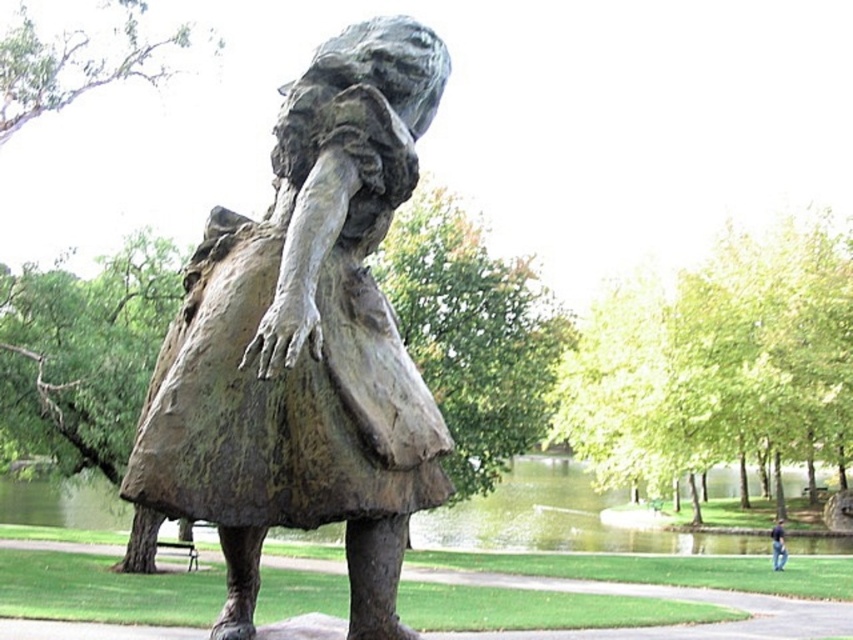
Question: Can you confirm if bronze statue at center is positioned to the left of dark blue jeans at lower right?

Choices:
 (A) no
 (B) yes

Answer: (B)

Question: In this image, where is bronze statue at center located relative to dark blue jeans at lower right?

Choices:
 (A) right
 (B) left

Answer: (B)

Question: Considering the relative positions of bronze statue at center and dark blue jeans at lower right in the image provided, where is bronze statue at center located with respect to dark blue jeans at lower right?

Choices:
 (A) above
 (B) below

Answer: (A)

Question: Which of the following is the closest to the observer?

Choices:
 (A) dark blue jeans at lower right
 (B) bronze statue at center

Answer: (B)